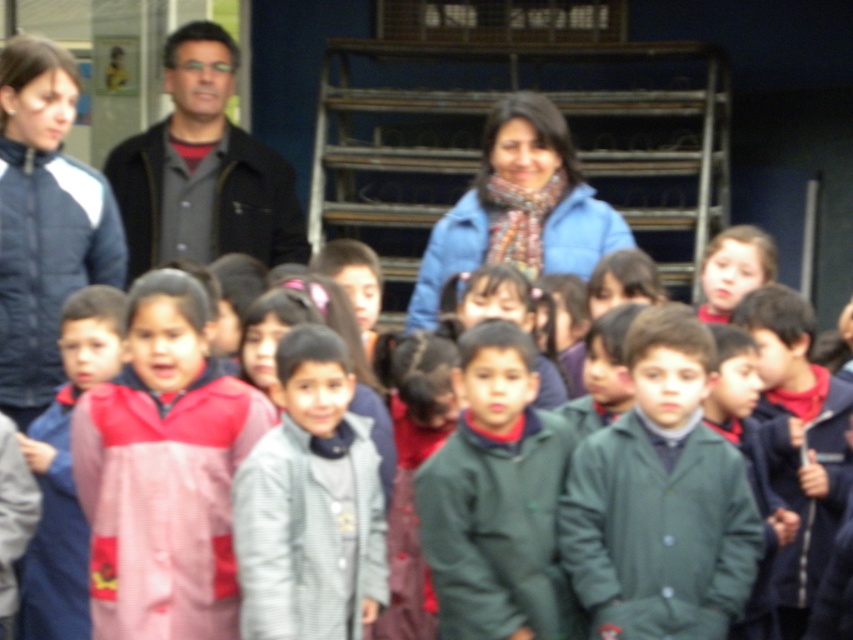
You are a photographer trying to adjust the spacing between the gray woolen jacket at center and the blue fleece jacket at center to ensure both fit within the frame. Based on their sizes, which jacket requires more space horizontally?

The gray woolen jacket at center might be wider than the blue fleece jacket at center, so it requires more horizontal space to fit within the frame.